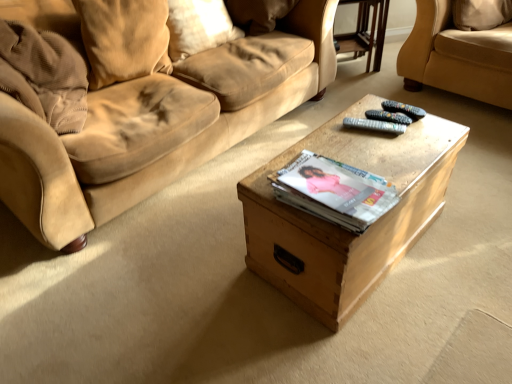
This screenshot has height=384, width=512. Find the location of `free point in front of black plastic remote at center, arranged as the second remote when viewed from the top`. free point in front of black plastic remote at center, arranged as the second remote when viewed from the top is located at coordinates click(x=386, y=148).